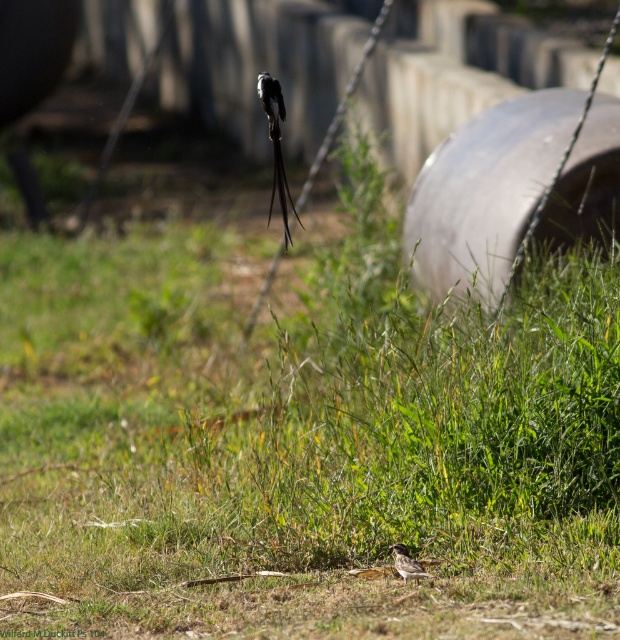
You are an ornithologist observing two birds in a natural outdoor setting. You notice the silvery metallic bird at center and the brown speckled bird at center. Which bird would cast a longer shadow if the sun is directly overhead?

The silvery metallic bird at center is much taller as brown speckled bird at center, so it would cast a longer shadow when the sun is directly overhead.

You are an ornithologist observing two birds in the scene. You notice both the silvery metallic bird at center and the brown speckled bird at center. Which bird appears closer to you based on their positions in the image?

The silvery metallic bird at center appears closer to you because it is further to the viewer than the brown speckled bird at center.